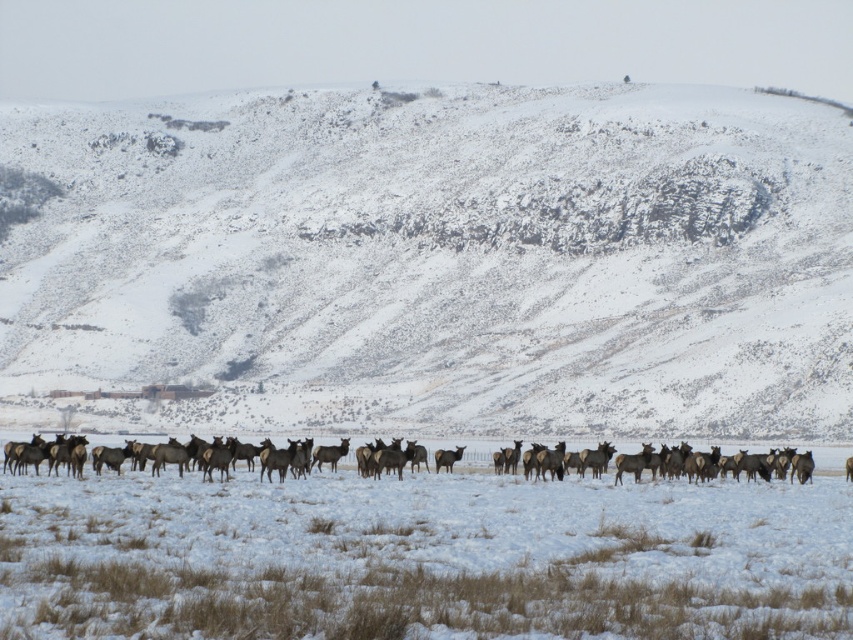
Locate an element on the screen. Image resolution: width=853 pixels, height=640 pixels. brown fur herd at center is located at coordinates (738, 465).

Who is taller, brown fur herd at center or brown fur at center?

brown fur herd at center

Does point (759, 472) lie in front of point (438, 465)?

Yes, it is.

What are the coordinates of `brown fur herd at center` in the screenshot? It's located at (738, 465).

Is snowy rock at center positioned in front of brown fur herd at center?

No, snowy rock at center is behind brown fur herd at center.

Does snowy rock at center have a larger size compared to brown fur herd at center?

Yes, snowy rock at center is bigger than brown fur herd at center.

Locate an element on the screen. This screenshot has width=853, height=640. snowy rock at center is located at coordinates (436, 262).

Who is taller, snowy rock at center or brown fur at center?

snowy rock at center is taller.

Is snowy rock at center to the right of brown fur at center from the viewer's perspective?

Incorrect, snowy rock at center is not on the right side of brown fur at center.

Which is behind, point (432, 157) or point (457, 445)?

Point (432, 157)

You are a GUI agent. You are given a task and a screenshot of the screen. Output one action in this format:
    pyautogui.click(x=<x>, y=<y>)
    Task: Click on the snowy rock at center
    
    Given the screenshot: What is the action you would take?
    pyautogui.click(x=436, y=262)